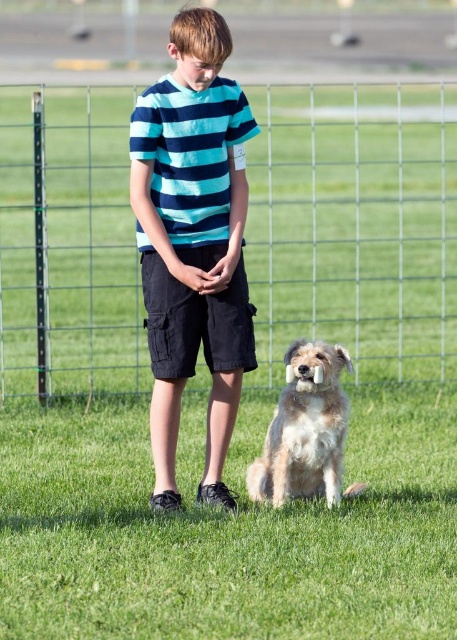
Question: Is green grass at lower center thinner than striped cotton shirt at center?

Choices:
 (A) yes
 (B) no

Answer: (B)

Question: Which point is closer to the camera taking this photo?

Choices:
 (A) (148, 240)
 (B) (31, 336)

Answer: (A)

Question: Is wire mesh fence at center thinner than striped cotton shirt at center?

Choices:
 (A) yes
 (B) no

Answer: (B)

Question: Among these points, which one is farthest from the camera?

Choices:
 (A) (340, 468)
 (B) (349, 339)

Answer: (B)

Question: Which point is closer to the camera?

Choices:
 (A) striped cotton t-shirt at center
 (B) wire mesh fence at center

Answer: (A)

Question: Is striped cotton t-shirt at center to the left of fuzzy beige dog at lower center from the viewer's perspective?

Choices:
 (A) yes
 (B) no

Answer: (A)